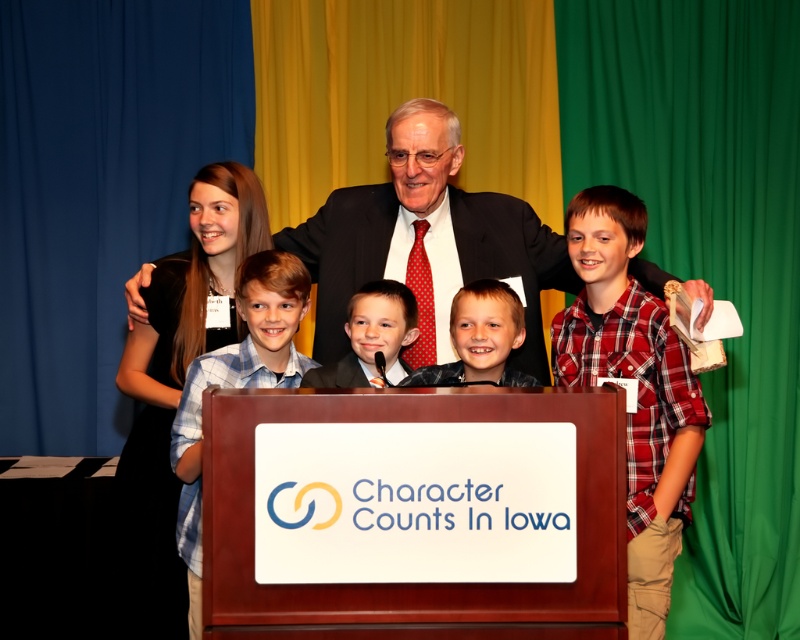
Question: Does black suit at center have a greater width compared to light brown hair at center?

Choices:
 (A) yes
 (B) no

Answer: (A)

Question: In this image, where is red plaid shirt at right located relative to blue plaid shirt at center?

Choices:
 (A) right
 (B) left

Answer: (A)

Question: Among these objects, which one is nearest to the camera?

Choices:
 (A) red plaid shirt at right
 (B) blue plaid shirt at center
 (C) light brown hair at center

Answer: (A)

Question: Which is nearer to the red plaid shirt at right?

Choices:
 (A) smooth black suit at center
 (B) light brown hair at center
 (C) blue plaid shirt at center
 (D) black suit at center

Answer: (B)

Question: Is red plaid shirt at right positioned in front of light brown hair at center?

Choices:
 (A) no
 (B) yes

Answer: (B)

Question: Among these points, which one is nearest to the camera?

Choices:
 (A) (633, 214)
 (B) (516, 333)
 (C) (425, 144)

Answer: (B)